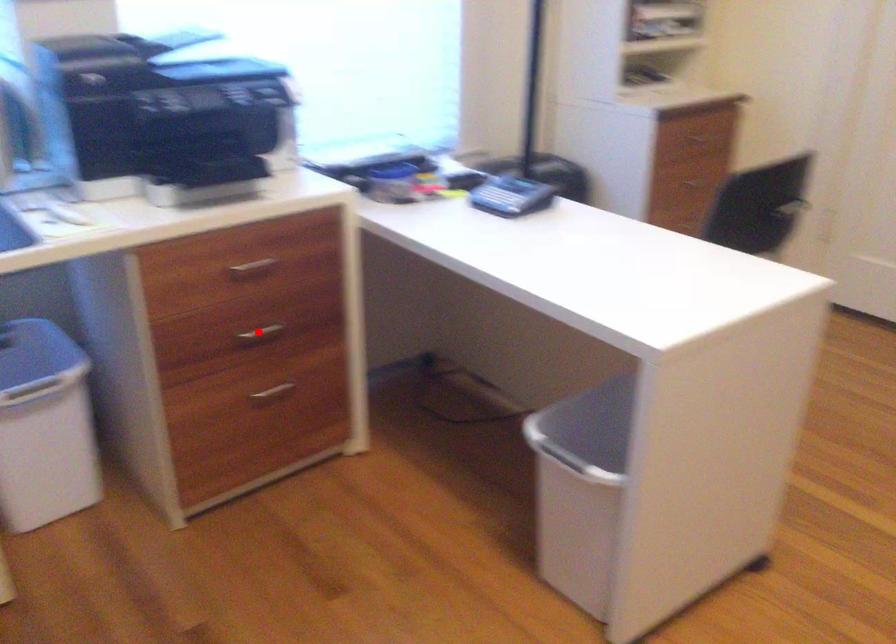
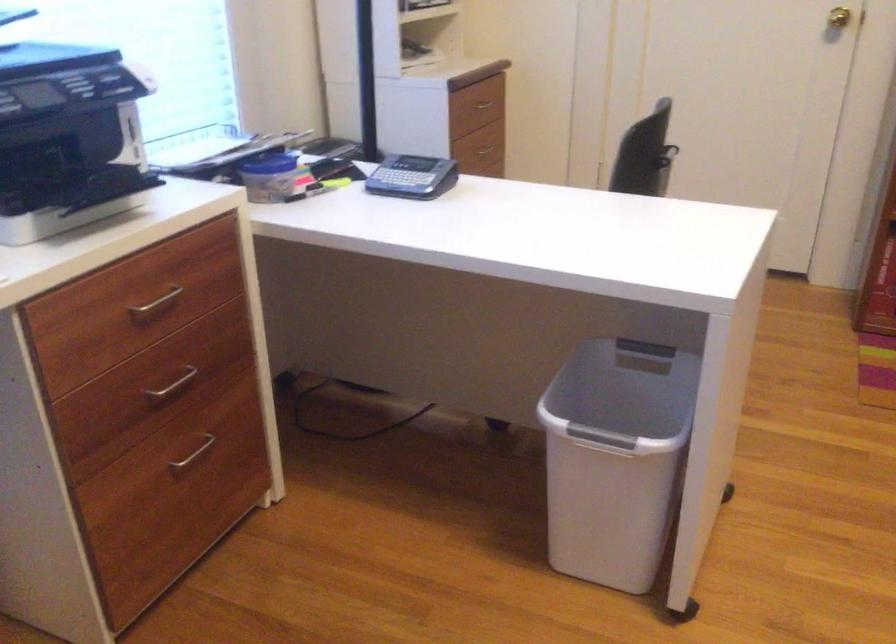
Locate, in the second image, the point that corresponds to the highlighted location in the first image.

(173, 384)